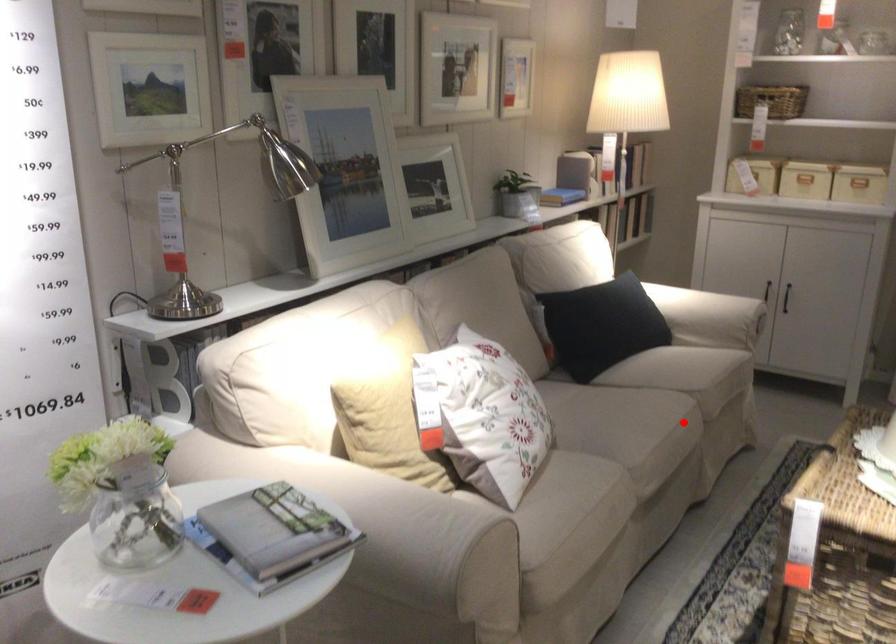
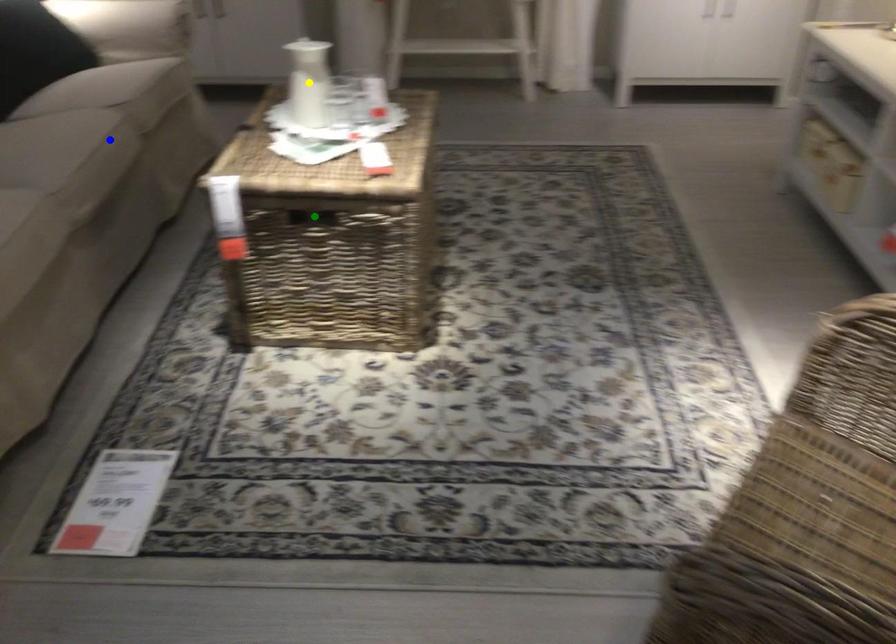
Question: I am providing you with two images of the same scene from different viewpoints. A red point is marked on the first image. You are given multiple points on the second image. Which point in image 2 represents the same 3d spot as the red point in image 1?

Choices:
 (A) yellow point
 (B) green point
 (C) blue point

Answer: (C)